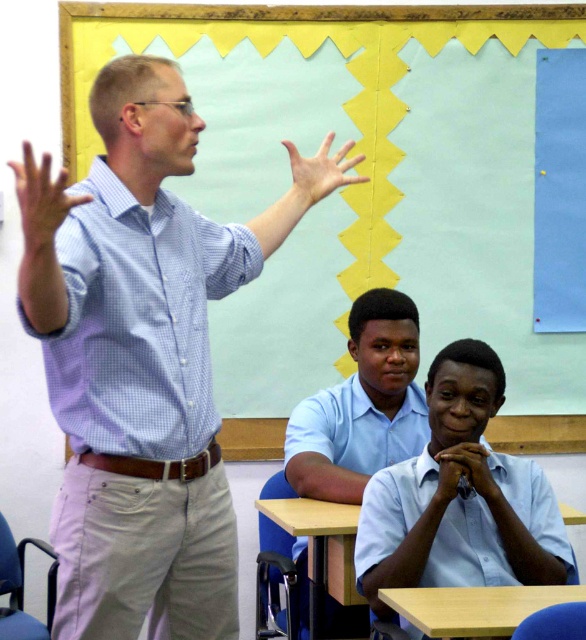
Question: Which object is farther from the camera taking this photo?

Choices:
 (A) wooden table at lower center
 (B) light blue shirt at lower right
 (C) light brown wooden table at lower center
 (D) blue checkered shirt at upper left

Answer: (A)

Question: Is light brown wooden table at lower center wider than wooden table at lower center?

Choices:
 (A) yes
 (B) no

Answer: (A)

Question: Which is farther from the yellow textured paper at upper center?

Choices:
 (A) matte blue shirt at upper left
 (B) matte skin hand at center
 (C) matte blue shirt at center

Answer: (A)

Question: Which of the following is the farthest from the observer?

Choices:
 (A) wooden table at lower center
 (B) yellow textured paper at upper center
 (C) light brown wooden table at lower center

Answer: (B)

Question: Is yellow textured paper at upper center behind blue checkered shirt at upper left?

Choices:
 (A) yes
 (B) no

Answer: (A)

Question: Can you confirm if blue checkered shirt at upper left is bigger than matte blue shirt at upper left?

Choices:
 (A) yes
 (B) no

Answer: (A)